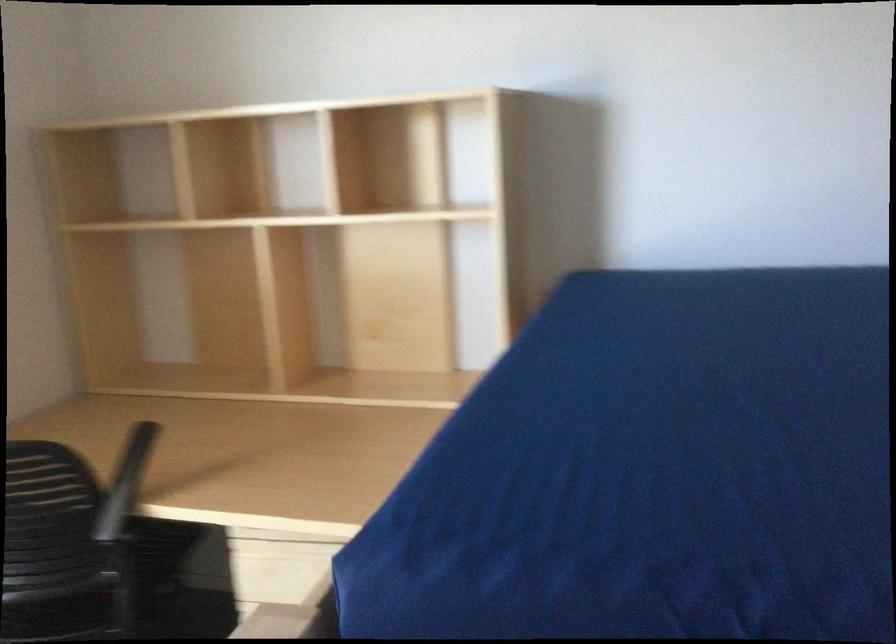
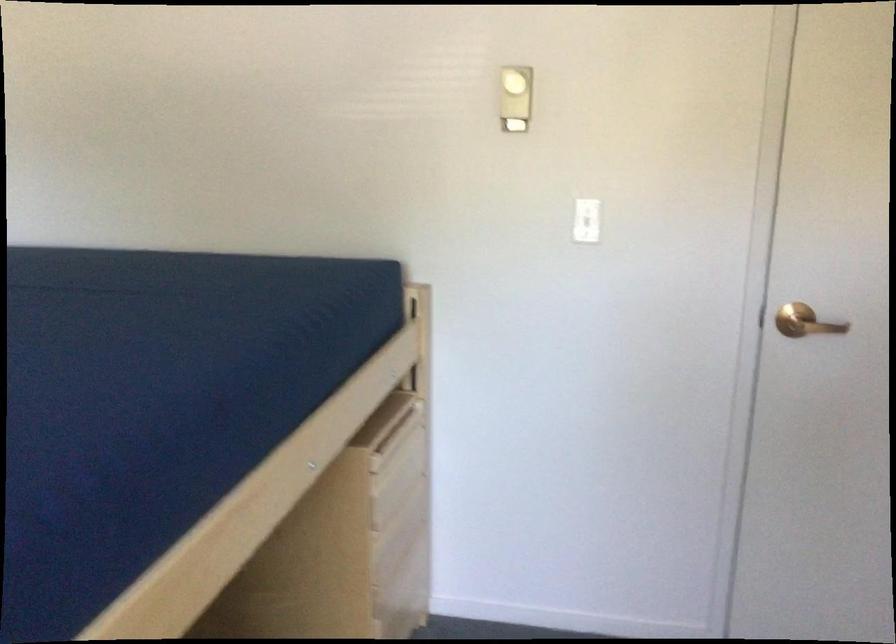
Question: The camera is either moving clockwise (left) or counter-clockwise (right) around the object. The first image is from the beginning of the video and the second image is from the end. Is the camera moving left or right when shooting the video?

Choices:
 (A) Left
 (B) Right

Answer: (A)